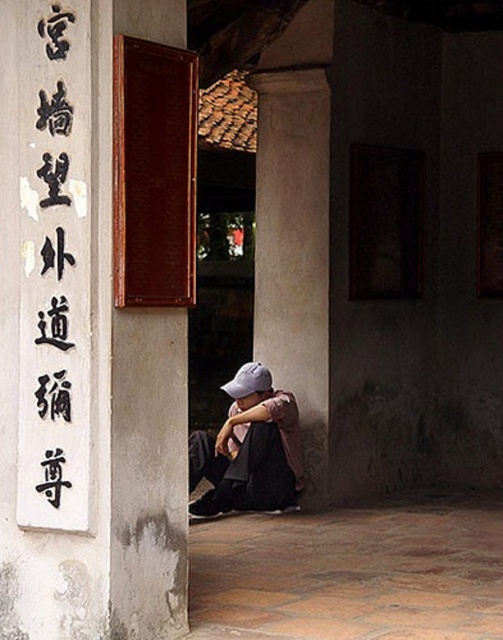
Question: Is black calligraphy at upper left wider than denim jacket at lower center?

Choices:
 (A) yes
 (B) no

Answer: (B)

Question: Which point appears farthest from the camera in this image?

Choices:
 (A) (90, 19)
 (B) (271, 477)
 (C) (31, 301)

Answer: (B)

Question: Which object is farther from the camera taking this photo?

Choices:
 (A) smooth concrete pillar at lower center
 (B) white stone sign at upper left
 (C) denim jacket at lower center
 (D) black calligraphy at upper left

Answer: (A)

Question: Can you confirm if smooth concrete pillar at lower center is wider than black calligraphy at upper left?

Choices:
 (A) yes
 (B) no

Answer: (A)

Question: Is black calligraphy at upper left closer to camera compared to denim jacket at lower center?

Choices:
 (A) no
 (B) yes

Answer: (B)

Question: Which point is farther from the camera taking this photo?

Choices:
 (A) (x=96, y=134)
 (B) (x=64, y=141)
 (C) (x=281, y=246)

Answer: (C)